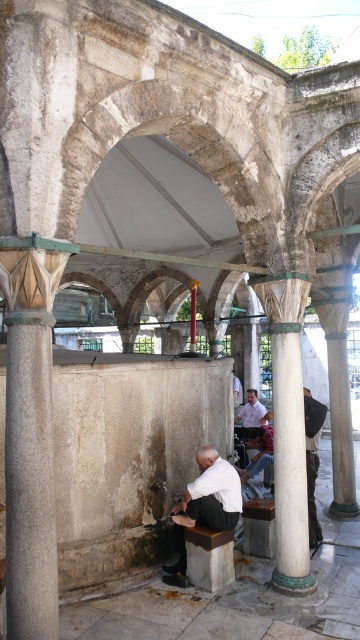
Question: Does white matte shirt at center appear on the left side of light brown leather jacket at center?

Choices:
 (A) yes
 (B) no

Answer: (A)

Question: Which object is closer to the camera taking this photo?

Choices:
 (A) white marble column at center
 (B) light brown leather jacket at center
 (C) white matte shirt at center

Answer: (A)

Question: Among these objects, which one is nearest to the camera?

Choices:
 (A) white marble column at center
 (B) white matte shirt at center
 (C) light brown leather jacket at center

Answer: (A)

Question: Does white marble column at center appear on the right side of light brown leather jacket at center?

Choices:
 (A) yes
 (B) no

Answer: (B)

Question: Which point appears closest to the camera in this image?

Choices:
 (A) (246, 426)
 (B) (306, 294)
 (C) (181, 497)

Answer: (B)

Question: Can you confirm if white marble column at center is bigger than light brown leather jacket at center?

Choices:
 (A) no
 (B) yes

Answer: (B)